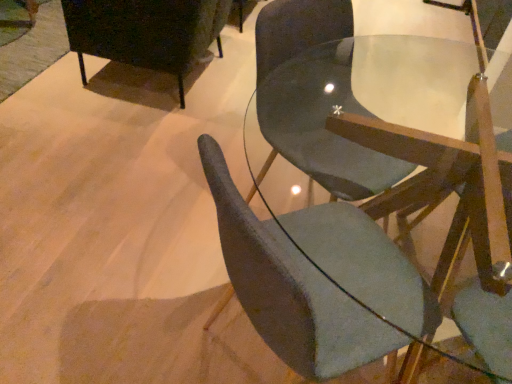
Question: In terms of height, does matte black cabinet at upper left, which is the first chair from left to right, look taller or shorter compared to matte gray chair at center, placed as the third chair when sorted from left to right?

Choices:
 (A) short
 (B) tall

Answer: (A)

Question: Do you think matte black cabinet at upper left, the third chair when ordered from right to left, is within matte gray chair at center, acting as the first chair starting from the right, or outside of it?

Choices:
 (A) inside
 (B) outside

Answer: (B)

Question: Which object is the farthest from the matte black cabinet at upper left, the third chair when ordered from right to left?

Choices:
 (A) matte gray chair at center, the 2th chair positioned from the right
 (B) matte gray chair at center, acting as the first chair starting from the right

Answer: (A)

Question: Which object is positioned closest to the matte gray chair at center, the 2th chair in the left-to-right sequence?

Choices:
 (A) matte black cabinet at upper left, the third chair when ordered from right to left
 (B) matte gray chair at center, placed as the third chair when sorted from left to right

Answer: (B)